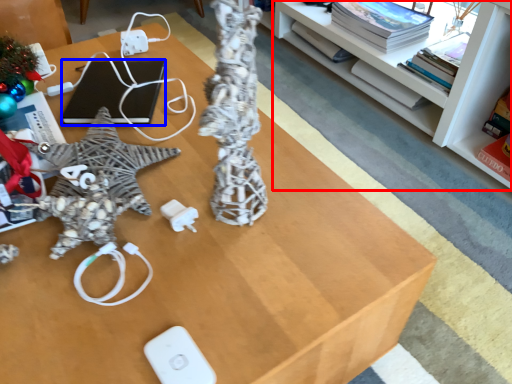
Question: Among these objects, which one is nearest to the camera, shelf (highlighted by a red box) or laptop (highlighted by a blue box)?

Choices:
 (A) shelf
 (B) laptop

Answer: (A)